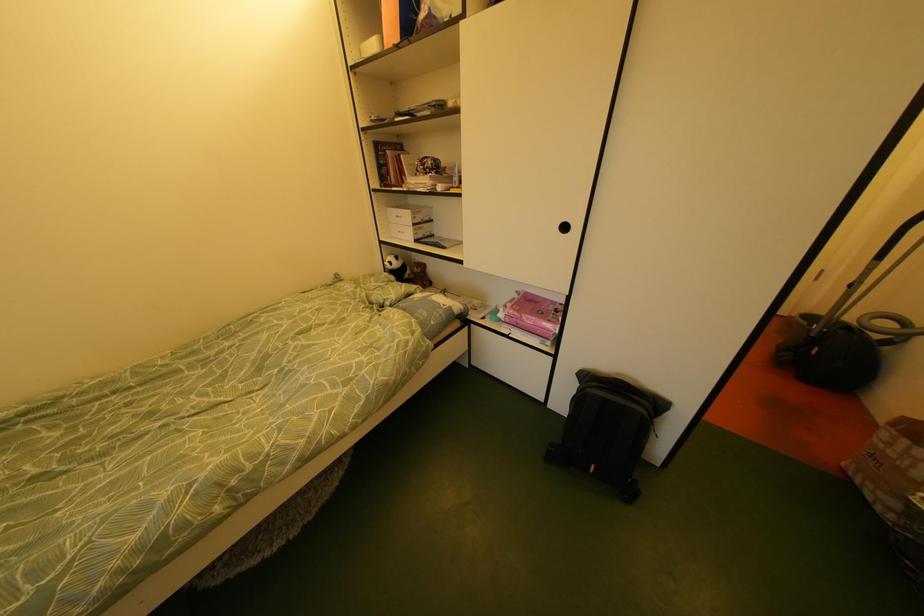
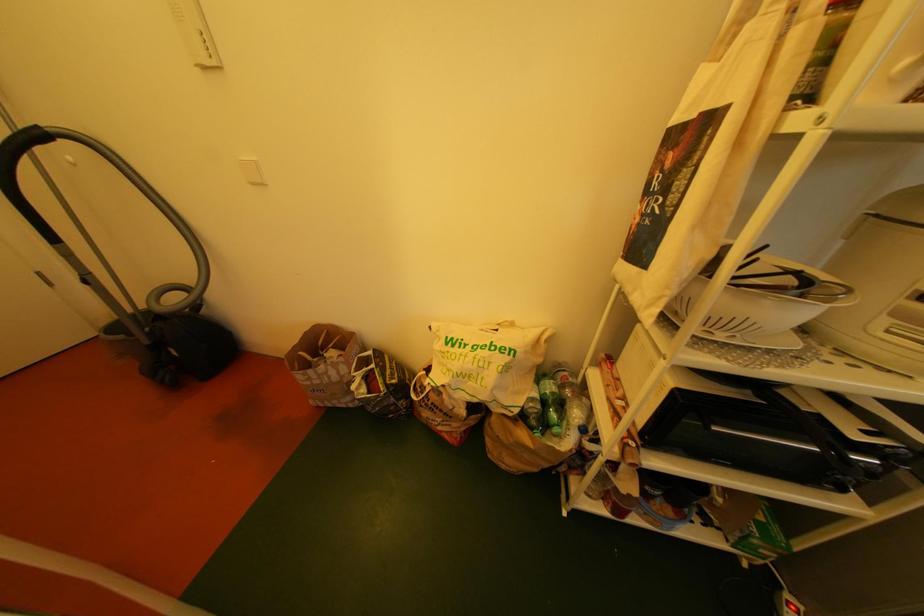
The images are taken continuously from a first-person perspective. In which direction is your viewpoint rotating?

The camera's rotation is toward right-down.